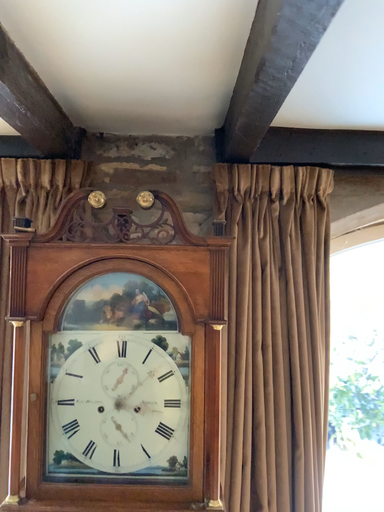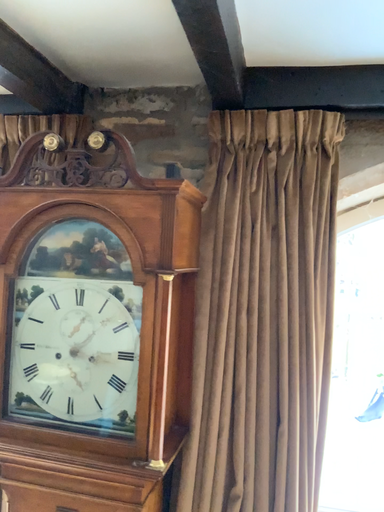
Question: Which way did the camera rotate in the video?

Choices:
 (A) rotated right
 (B) rotated left

Answer: (B)